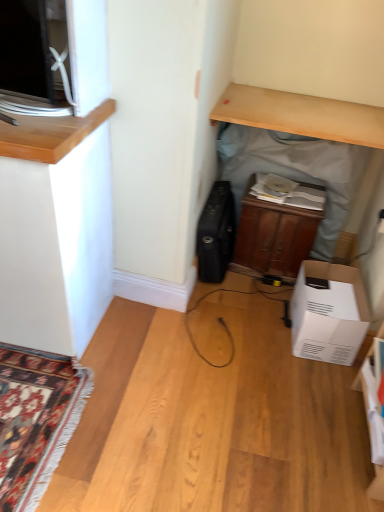
Locate an element on the screen. Image resolution: width=384 pixels, height=512 pixels. free location in front of white cardboard box at lower right is located at coordinates (317, 385).